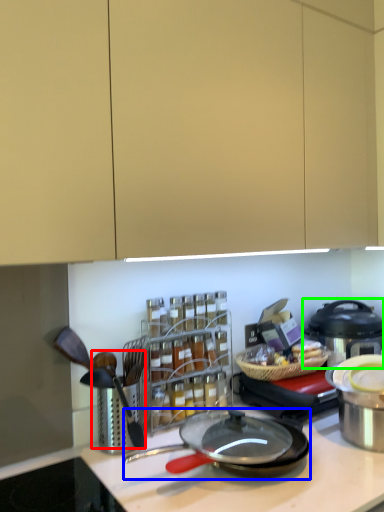
Question: Based on their relative distances, which object is nearer to utensil (highlighted by a red box)? Choose from frying pan (highlighted by a blue box) and kitchen appliance (highlighted by a green box).

Choices:
 (A) frying pan
 (B) kitchen appliance

Answer: (A)